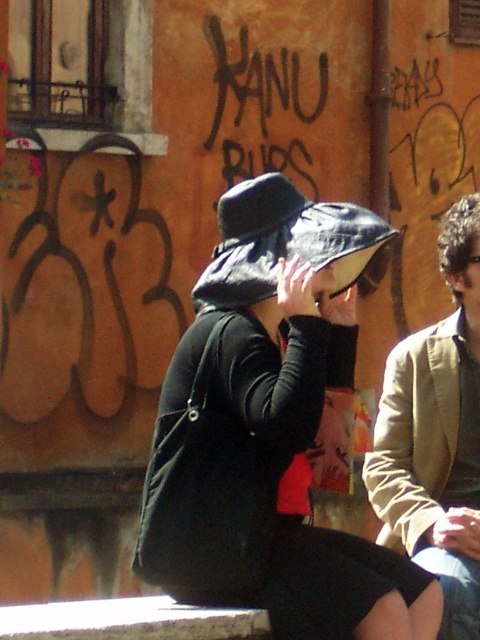
Can you confirm if matte black hat at center is positioned above matte black hat at upper center?

Incorrect, matte black hat at center is not positioned above matte black hat at upper center.

Between point (320, 339) and point (475, 243), which one is positioned in front?

Positioned in front is point (320, 339).

Find the location of a particular element. The height and width of the screenshot is (640, 480). matte black hat at center is located at coordinates [x=268, y=429].

Does tan fabric jacket at right have a lesser height compared to matte black hat at upper center?

Incorrect, tan fabric jacket at right's height does not fall short of matte black hat at upper center's.

Where is `tan fabric jacket at right`? The height and width of the screenshot is (640, 480). tan fabric jacket at right is located at coordinates (434, 442).

Locate an element on the screen. tan fabric jacket at right is located at coordinates (434, 442).

How much distance is there between matte black hat at center and tan fabric jacket at right?

They are 1.26 meters apart.

Does matte black hat at center have a greater height compared to tan fabric jacket at right?

Yes.

Does point (227, 248) lie in front of point (454, 294)?

That is True.

Where is `matte black hat at center`? matte black hat at center is located at coordinates (268, 429).